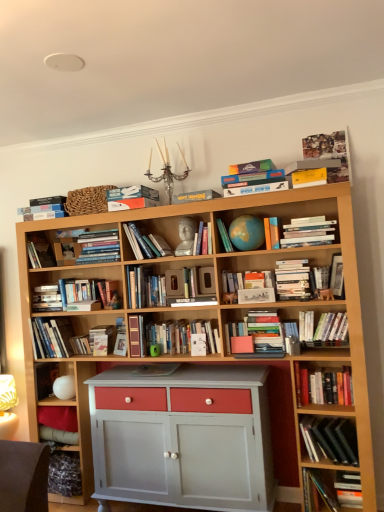
Question: Can you confirm if hardcover books at left, which is the eleventh book in right-to-left order, is thinner than hardcover books at center, arranged as the sixth book when viewed from the right?

Choices:
 (A) yes
 (B) no

Answer: (B)

Question: Is hardcover books at left, which is the eleventh book in right-to-left order, looking in the opposite direction of hardcover books at center, which is counted as the eighth book, starting from the left?

Choices:
 (A) no
 (B) yes

Answer: (A)

Question: Would you consider hardcover books at left, positioned as the 3th book in left-to-right order, to be distant from hardcover books at center, arranged as the sixth book when viewed from the right?

Choices:
 (A) no
 (B) yes

Answer: (B)

Question: Is hardcover books at left, positioned as the 3th book in left-to-right order, with hardcover books at center, which is counted as the eighth book, starting from the left?

Choices:
 (A) no
 (B) yes

Answer: (A)

Question: Considering the relative sizes of hardcover books at left, which is the eleventh book in right-to-left order, and hardcover books at center, which is counted as the eighth book, starting from the left, in the image provided, is hardcover books at left, which is the eleventh book in right-to-left order, bigger than hardcover books at center, which is counted as the eighth book, starting from the left,?

Choices:
 (A) no
 (B) yes

Answer: (B)

Question: From the image's perspective, is hardcover books at left, which is the eleventh book in right-to-left order, below hardcover books at center, which is counted as the eighth book, starting from the left?

Choices:
 (A) no
 (B) yes

Answer: (B)

Question: Would you say hardcover books at upper center, the tenth book viewed from the left, is outside hardcover books at left, positioned as the 3th book in left-to-right order?

Choices:
 (A) yes
 (B) no

Answer: (A)

Question: From the image's perspective, is hardcover books at upper center, the 4th book viewed from the right, over hardcover books at left, which is the eleventh book in right-to-left order?

Choices:
 (A) yes
 (B) no

Answer: (A)

Question: From the image's perspective, is hardcover books at upper center, the 4th book viewed from the right, beneath hardcover books at left, which is the eleventh book in right-to-left order?

Choices:
 (A) no
 (B) yes

Answer: (A)

Question: From a real-world perspective, is hardcover books at upper center, the tenth book viewed from the left, on top of hardcover books at left, which is the eleventh book in right-to-left order?

Choices:
 (A) no
 (B) yes

Answer: (B)

Question: From a real-world perspective, is hardcover books at upper center, the 4th book viewed from the right, below hardcover books at left, which is the eleventh book in right-to-left order?

Choices:
 (A) yes
 (B) no

Answer: (B)

Question: Can you confirm if hardcover books at upper center, the tenth book viewed from the left, is shorter than hardcover books at left, positioned as the 3th book in left-to-right order?

Choices:
 (A) yes
 (B) no

Answer: (A)

Question: From a real-world perspective, is yellow matte paperback book at upper right, the first paperback book viewed from the right, below hardcover book at center, which is counted as the sixth book, starting from the left?

Choices:
 (A) yes
 (B) no

Answer: (B)